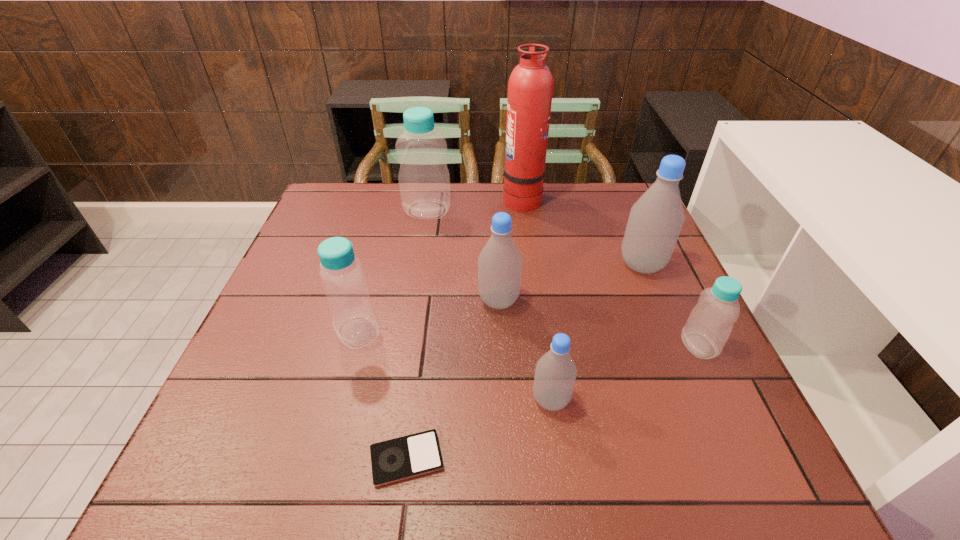
The image size is (960, 540). Find the location of `the fourth bottle from left to right`. the fourth bottle from left to right is located at coordinates (555, 374).

Identify the location of gray iPod. (410, 456).

Locate an element on the screen. This screenshot has width=960, height=540. the shortest object is located at coordinates click(x=410, y=456).

The width and height of the screenshot is (960, 540). What are the coordinates of `vacant space located on the label side of the tallest object` in the screenshot? It's located at (483, 198).

The height and width of the screenshot is (540, 960). I want to click on vacant space located on the label side of the tallest object, so click(406, 198).

What are the coordinates of `free space located 0.120m on the label side of the tallest object` in the screenshot? It's located at (464, 198).

The width and height of the screenshot is (960, 540). I want to click on blank space located on the front of the farthest blue bottle, so click(x=413, y=301).

I want to click on free space located on the front of the biggest gray bottle, so click(x=703, y=410).

The width and height of the screenshot is (960, 540). In order to click on free space located on the right of the second biggest blue bottle in this screenshot , I will do `click(514, 332)`.

Locate an element on the screen. vacant space located on the left of the second farthest gray bottle is located at coordinates coord(436,300).